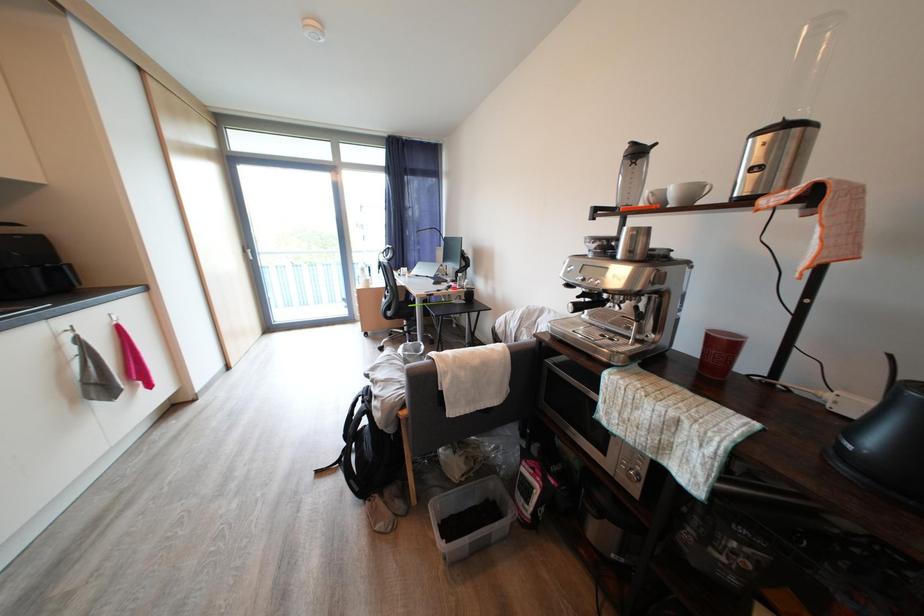
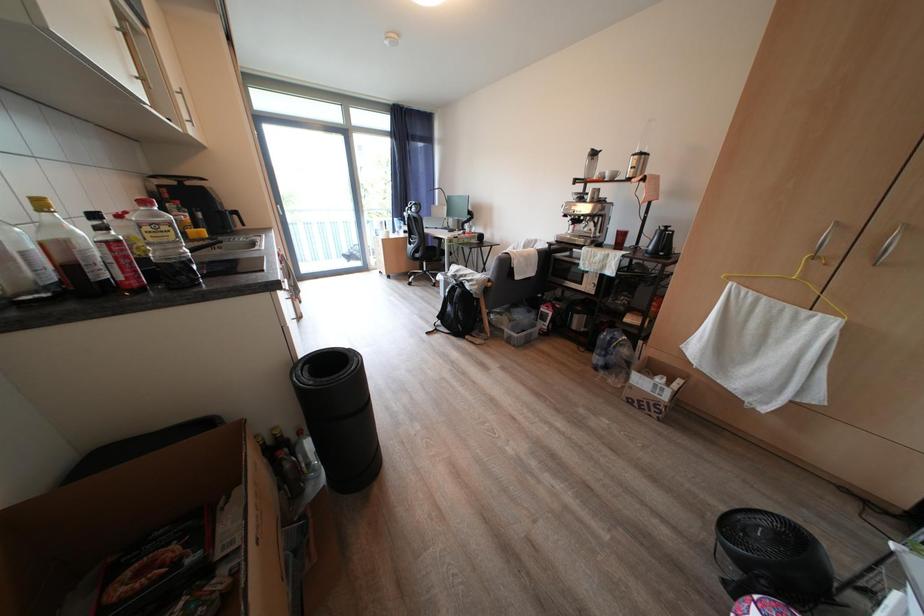
The images are taken continuously from a first-person perspective. In which direction are you moving?

The movement direction of the cameraman is left, backward.